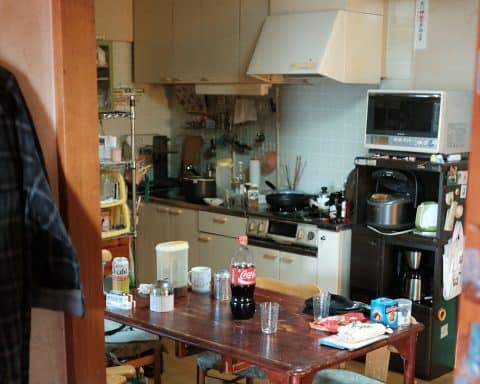
Where is `doors to shelf`? The height and width of the screenshot is (384, 480). doors to shelf is located at coordinates (294, 265), (210, 245), (185, 224).